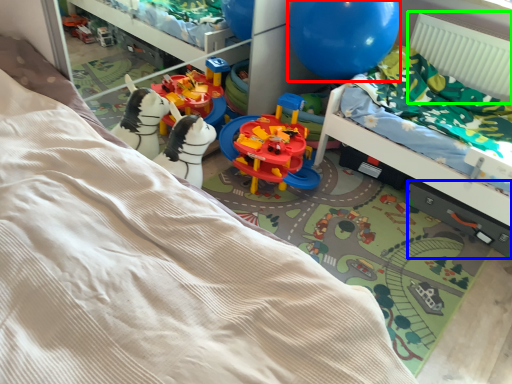
Question: Estimate the real-world distances between objects in this image. Which object is farther from balloon (highlighted by a red box), drawer (highlighted by a blue box) or radiator (highlighted by a green box)?

Choices:
 (A) drawer
 (B) radiator

Answer: (A)